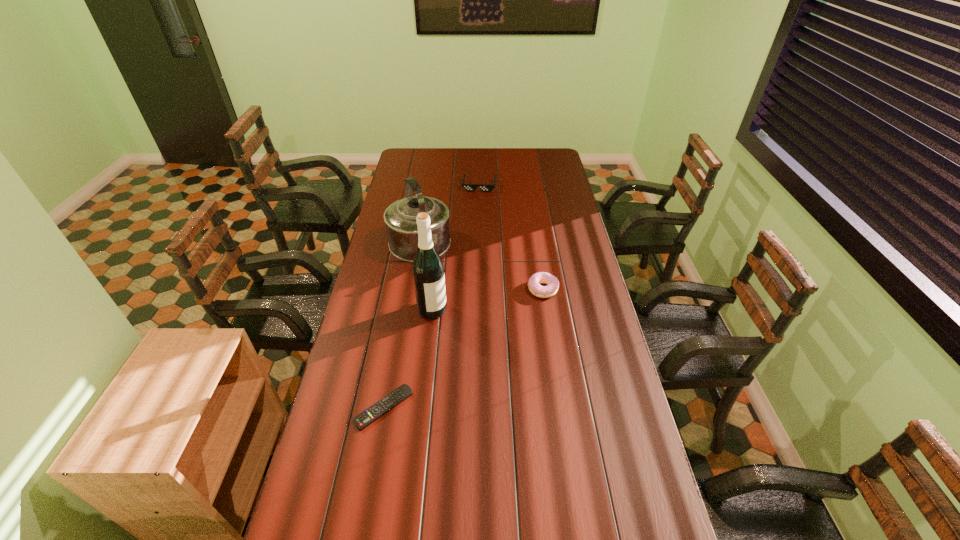
Locate an element on the screen. The width and height of the screenshot is (960, 540). free point located on the front-facing side of the farthest object is located at coordinates (476, 212).

The width and height of the screenshot is (960, 540). I want to click on vacant space located on the front-facing side of the farthest object, so click(477, 199).

Where is `vacant position located on the front-facing side of the farthest object`? This screenshot has width=960, height=540. vacant position located on the front-facing side of the farthest object is located at coordinates (476, 207).

Locate an element on the screen. Image resolution: width=960 pixels, height=540 pixels. free space located 0.110m with the spout at the front of the kettle is located at coordinates (440, 287).

At what (x,y) coordinates should I click in order to perform the action: click on vacant space located 0.340m with the spout at the front of the kettle. Please return your answer as a coordinate pair (x, y). This screenshot has height=540, width=960. Looking at the image, I should click on (463, 327).

In order to click on free space located with the spout at the front of the kettle in this screenshot , I will do `click(440, 287)`.

In order to click on vacant area located on the label of the wine bottle in this screenshot , I will do `click(495, 367)`.

Where is `vacant region located on the label of the wine bottle`? This screenshot has height=540, width=960. vacant region located on the label of the wine bottle is located at coordinates (495, 367).

Identify the location of vacant space located 0.400m on the label of the wine bottle. tap(519, 388).

Image resolution: width=960 pixels, height=540 pixels. In order to click on remote control at the left edge in this screenshot , I will do `click(387, 403)`.